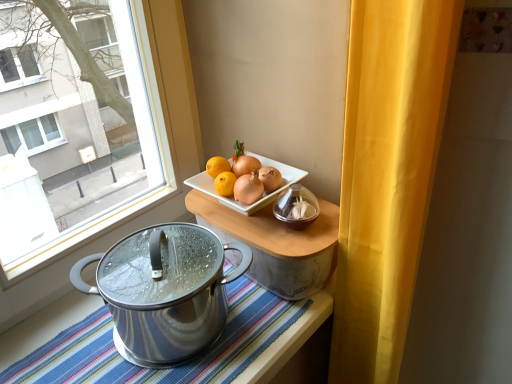
This screenshot has width=512, height=384. What are the coordinates of `blank space to the left of polished stainless steel pot at lower left` in the screenshot? It's located at (65, 336).